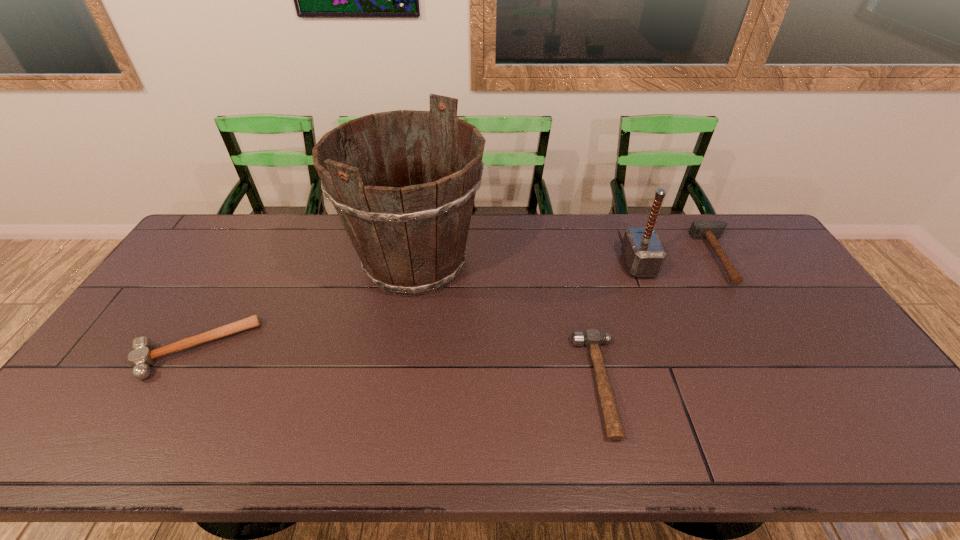
Find the location of `free spot between the second tallest hammer and the bucket`. free spot between the second tallest hammer and the bucket is located at coordinates (567, 260).

Where is `free space that is in between the second object from left to right and the third shortest object`? The height and width of the screenshot is (540, 960). free space that is in between the second object from left to right and the third shortest object is located at coordinates (567, 260).

Locate an element on the screen. The height and width of the screenshot is (540, 960). empty space that is in between the second hammer from left to right and the third shortest object is located at coordinates (660, 321).

Locate an element on the screen. The height and width of the screenshot is (540, 960). free spot between the second tallest hammer and the third object from left to right is located at coordinates (660, 321).

Locate an element on the screen. The width and height of the screenshot is (960, 540). free space between the tallest object and the fourth object from left to right is located at coordinates (527, 264).

Locate an element on the screen. The image size is (960, 540). free space between the leftmost hammer and the tallest hammer is located at coordinates (417, 307).

Find the location of a particular element. Image resolution: width=960 pixels, height=540 pixels. free space that is in between the leftmost hammer and the tallest object is located at coordinates (305, 306).

Locate an element on the screen. The width and height of the screenshot is (960, 540). object that is the nearest to the tallest hammer is located at coordinates (711, 230).

Identify which object is the third closest to the second hammer from right to left. Please provide its 2D coordinates. Your answer should be formatted as a tuple, i.e. [(x, y)], where the tuple contains the x and y coordinates of a point satisfying the conditions above.

[(411, 240)]

Select which hammer appears as the third closest to the tallest hammer. Please provide its 2D coordinates. Your answer should be formatted as a tuple, i.e. [(x, y)], where the tuple contains the x and y coordinates of a point satisfying the conditions above.

[(141, 357)]